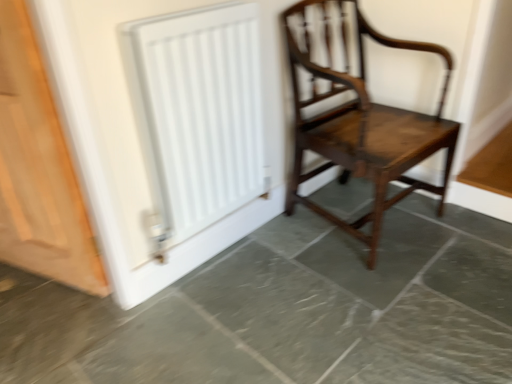
Identify the location of vacant space underneath mahogany wooden chair at center (from a real-world perspective). (349, 210).